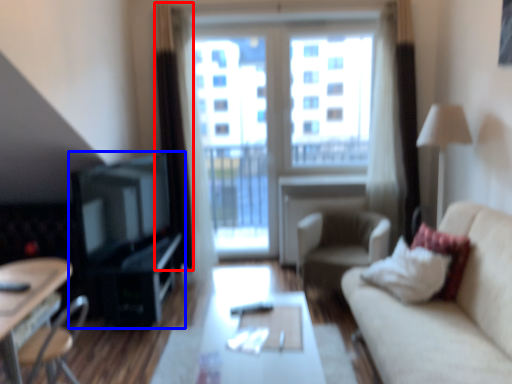
Question: Which object is closer to the camera taking this photo, curtain (highlighted by a red box) or entertainment center (highlighted by a blue box)?

Choices:
 (A) curtain
 (B) entertainment center

Answer: (B)